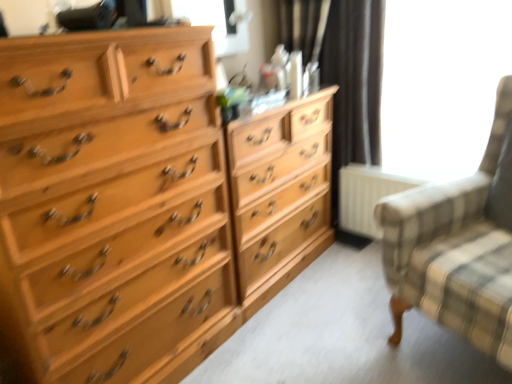
Question: Does light wood chest of drawers at left have a greater height compared to light wood dresser at center?

Choices:
 (A) no
 (B) yes

Answer: (B)

Question: Is light wood chest of drawers at left thinner than light wood dresser at center?

Choices:
 (A) yes
 (B) no

Answer: (B)

Question: From the image's perspective, is light wood chest of drawers at left beneath light wood dresser at center?

Choices:
 (A) yes
 (B) no

Answer: (A)

Question: Could you tell me if light wood chest of drawers at left is turned towards light wood dresser at center?

Choices:
 (A) yes
 (B) no

Answer: (B)

Question: Considering the relative sizes of light wood chest of drawers at left and light wood dresser at center in the image provided, is light wood chest of drawers at left smaller than light wood dresser at center?

Choices:
 (A) no
 (B) yes

Answer: (A)

Question: Is white matte radiator at lower right taller or shorter than light wood chest of drawers at left?

Choices:
 (A) short
 (B) tall

Answer: (A)

Question: From the image's perspective, is white matte radiator at lower right positioned above or below light wood chest of drawers at left?

Choices:
 (A) above
 (B) below

Answer: (A)

Question: Considering their positions, is white matte radiator at lower right located in front of or behind light wood chest of drawers at left?

Choices:
 (A) behind
 (B) front

Answer: (A)

Question: Does point click(398, 180) appear closer or farther from the camera than point click(287, 233)?

Choices:
 (A) farther
 (B) closer

Answer: (A)

Question: Considering the positions of black fabric curtain at upper center and transparent glass window at upper right, which is the second window screen from left to right, in the image, is black fabric curtain at upper center taller or shorter than transparent glass window at upper right, which is the second window screen from left to right,?

Choices:
 (A) tall
 (B) short

Answer: (A)

Question: Is black fabric curtain at upper center in front of or behind transparent glass window at upper right, which is the second window screen from left to right, in the image?

Choices:
 (A) front
 (B) behind

Answer: (B)

Question: Is black fabric curtain at upper center situated inside transparent glass window at upper right, which is the second window screen from left to right, or outside?

Choices:
 (A) outside
 (B) inside

Answer: (A)

Question: Considering the positions of black fabric curtain at upper center and transparent glass window at upper right, which is the second window screen from left to right, in the image, is black fabric curtain at upper center wider or thinner than transparent glass window at upper right, which is the second window screen from left to right,?

Choices:
 (A) wide
 (B) thin

Answer: (A)

Question: Considering the positions of plaid fabric rocking chair at right and white matte radiator at lower right in the image, is plaid fabric rocking chair at right wider or thinner than white matte radiator at lower right?

Choices:
 (A) thin
 (B) wide

Answer: (B)

Question: Is plaid fabric rocking chair at right taller or shorter than white matte radiator at lower right?

Choices:
 (A) tall
 (B) short

Answer: (A)